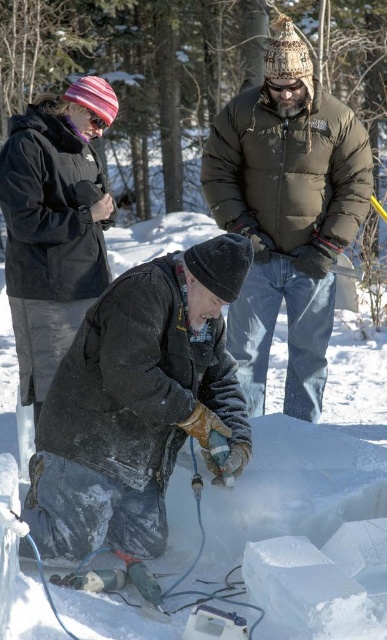
You are a photographer trying to capture the ice carving activity. You want to place your tripod in an area that is not obstructed by the white frosty snow at center. Based on the coordinates provided, where should you position your tripod?

The white frosty snow at center is located at point (306, 451), so you should position your tripod away from that coordinate to avoid obstruction.

You are standing in the winter scene and want to take a closer look at the point marked at coordinates (215,262). If you walk 10 feet towards it, will you reach the point?

The point at coordinates (215,262) is 11.17 feet away from the camera. Walking 10 feet towards it would leave you 1.17 feet short of reaching the point.